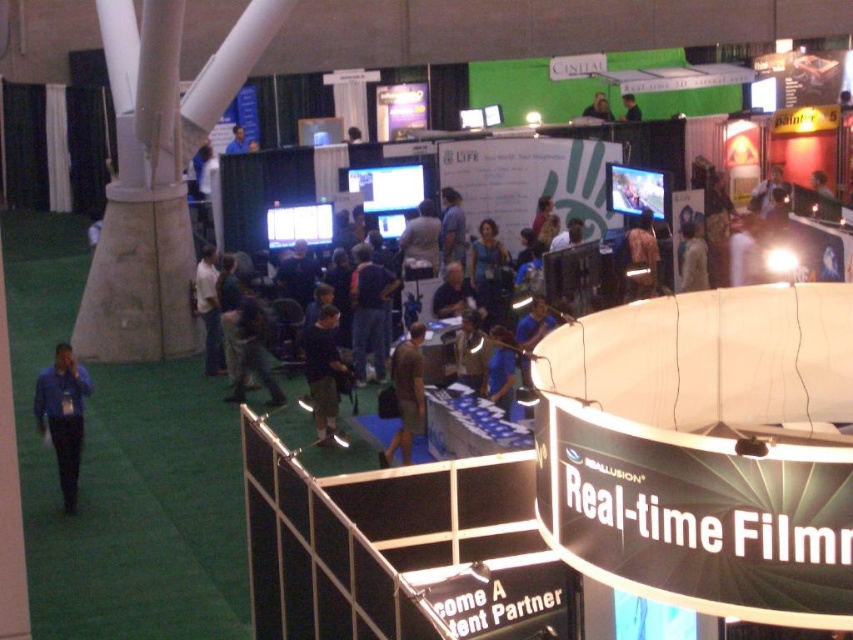
You are an event organizer trying to determine the best way to arrange chairs for a presentation. You notice two items at the center of the scene, the khaki shorts at center and the light brown leather jacket at center. Which of these two items takes up more space in the scene?

The light brown leather jacket at center takes up more space than the khaki shorts at center because the khaki shorts at center is smaller than the light brown leather jacket at center.